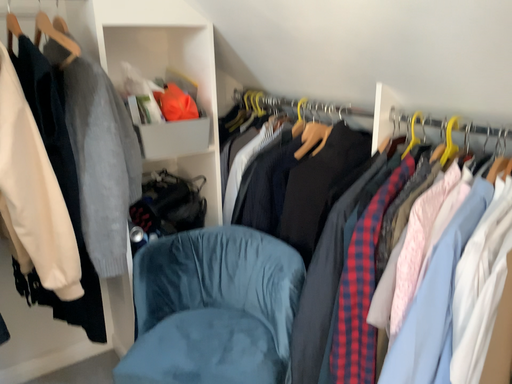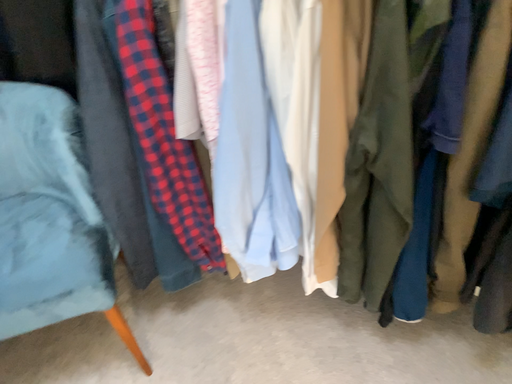
Question: How did the camera likely rotate when shooting the video?

Choices:
 (A) rotated right
 (B) rotated left

Answer: (A)